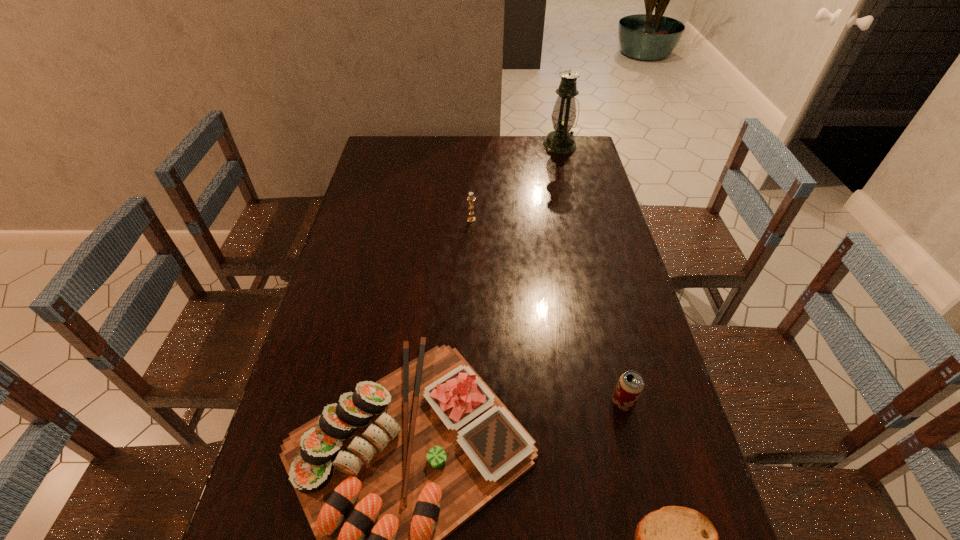
This screenshot has width=960, height=540. I want to click on the tallest object, so click(x=560, y=141).

The width and height of the screenshot is (960, 540). I want to click on the farthest object, so click(x=560, y=141).

You are a GUI agent. You are given a task and a screenshot of the screen. Output one action in this format:
    pyautogui.click(x=<x>, y=<y>)
    Task: Click on the candle holder
    The image size is (960, 540).
    Given the screenshot: What is the action you would take?
    pyautogui.click(x=471, y=198)

Image resolution: width=960 pixels, height=540 pixels. I want to click on beer can, so click(x=631, y=384).

The image size is (960, 540). I want to click on vacant space located on the front of the farthest object, so click(x=566, y=174).

The height and width of the screenshot is (540, 960). I want to click on vacant region located 0.380m on the left of the candle holder, so click(x=357, y=220).

Where is `vacant region located on the front of the beer can`? The height and width of the screenshot is (540, 960). vacant region located on the front of the beer can is located at coordinates (634, 447).

Locate an element on the screen. Image resolution: width=960 pixels, height=540 pixels. object present at the far edge is located at coordinates (560, 141).

I want to click on oil lamp present at the right edge, so click(560, 141).

Where is `beer can that is at the right edge`? beer can that is at the right edge is located at coordinates (631, 384).